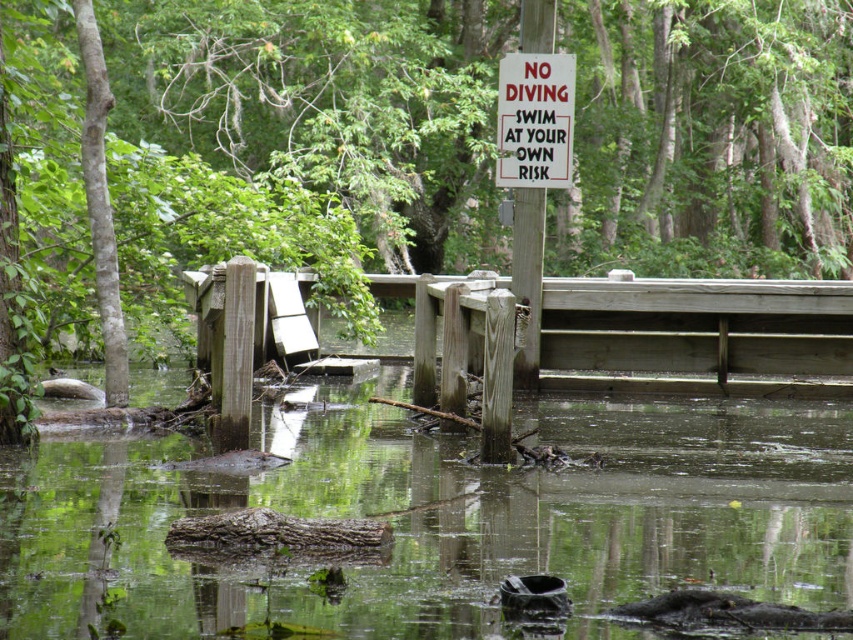
Is white paper sign at upper center wider than white wood sign at center?

Yes, white paper sign at upper center is wider than white wood sign at center.

Who is more distant from viewer, (541, 109) or (527, 230)?

Positioned behind is point (527, 230).

In the scene shown: Who is more distant from viewer, (563, 108) or (526, 282)?

Point (526, 282)

I want to click on white paper sign at upper center, so [535, 120].

Does clear water at center appear under weathered wood dock at center?

Correct, clear water at center is located below weathered wood dock at center.

The image size is (853, 640). What do you see at coordinates (437, 516) in the screenshot? I see `clear water at center` at bounding box center [437, 516].

Between point (207, 628) and point (722, 333), which one is positioned behind?

Point (722, 333)

Locate an element on the screen. This screenshot has width=853, height=640. clear water at center is located at coordinates (437, 516).

Can you confirm if weathered wood dock at center is shorter than white wood sign at center?

Correct, weathered wood dock at center is not as tall as white wood sign at center.

Is weathered wood dock at center to the left of white wood sign at center from the viewer's perspective?

In fact, weathered wood dock at center is to the right of white wood sign at center.

This screenshot has height=640, width=853. What do you see at coordinates (694, 337) in the screenshot?
I see `weathered wood dock at center` at bounding box center [694, 337].

Where is `weathered wood dock at center`? The height and width of the screenshot is (640, 853). weathered wood dock at center is located at coordinates (694, 337).